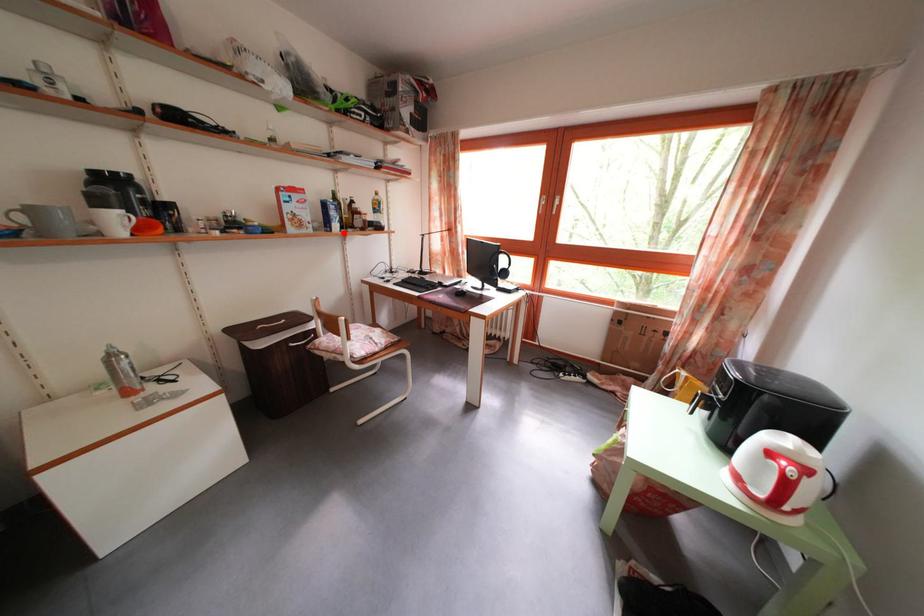
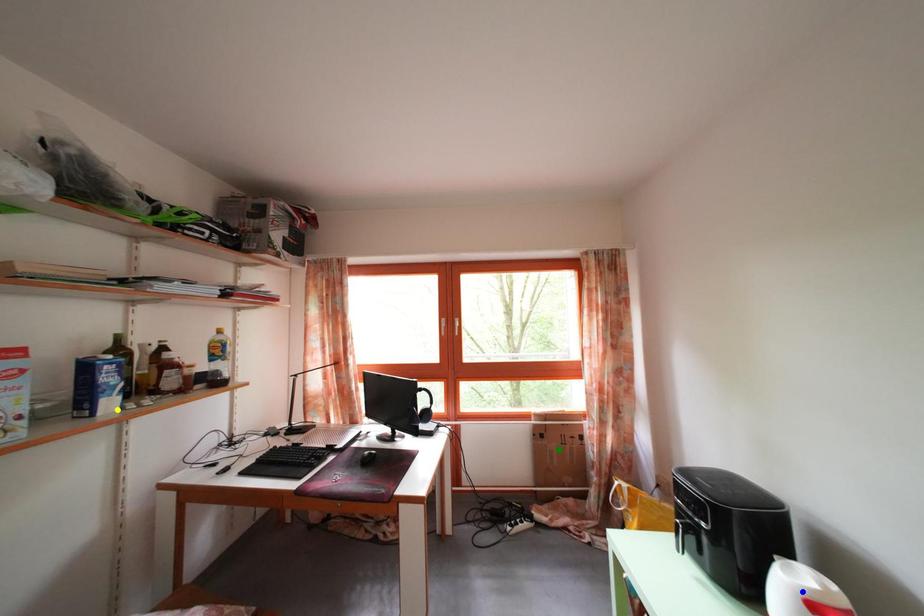
Question: I am providing you with two images of the same scene from different viewpoints. A red point is marked on the first image. You are given multiple points on the second image. In image 2, which mark is for the same physical point as the one in image 1?

Choices:
 (A) green point
 (B) yellow point
 (C) blue point

Answer: (B)